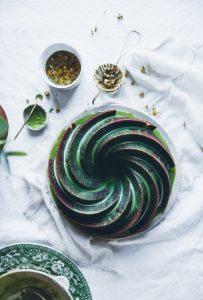
This screenshot has height=300, width=203. Find the location of `white bowl`. white bowl is located at coordinates (67, 84).